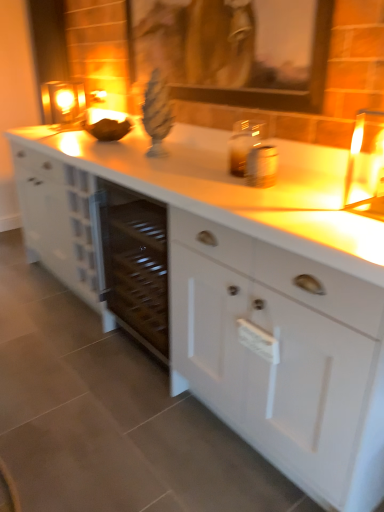
This screenshot has height=512, width=384. What are the coordinates of `wooden picture frame at upper center` in the screenshot? It's located at (235, 51).

At what (x,y) coordinates should I click in order to perform the action: click on matte glass candle at upper left. Please return your answer as a coordinate pair (x, y). Looking at the image, I should click on (63, 102).

You are a GUI agent. You are given a task and a screenshot of the screen. Output one action in this format:
    pyautogui.click(x=<x>, y=<y>)
    Task: Click on the wooden picture frame at upper center
    The image size is (384, 512).
    Given the screenshot: What is the action you would take?
    pyautogui.click(x=235, y=51)

Considering the relative positions of matte glass candle at upper left and white matte cabinet at center in the image provided, is matte glass candle at upper left in front of white matte cabinet at center?

No, matte glass candle at upper left is further to the viewer.

Is point (62, 89) behind point (190, 360)?

Yes, it is behind point (190, 360).

In the scene shown: Which of these two, matte glass candle at upper left or white matte cabinet at center, is bigger?

With larger size is white matte cabinet at center.

How different are the orientations of matte glass candle at upper left and white matte cabinet at center in degrees?

The angular difference between matte glass candle at upper left and white matte cabinet at center is 0.000517 degrees.

From a real-world perspective, does white matte cabinet at center sit lower than wooden picture frame at upper center?

Yes.

Considering the sizes of objects white matte cabinet at center and wooden picture frame at upper center in the image provided, who is bigger, white matte cabinet at center or wooden picture frame at upper center?

With larger size is white matte cabinet at center.

Is white matte cabinet at center further to camera compared to wooden picture frame at upper center?

No, white matte cabinet at center is closer to the viewer.

From a real-world perspective, is wooden picture frame at upper center positioned above or below white matte cabinet at center?

In terms of real-world spatial position, wooden picture frame at upper center is above white matte cabinet at center.

Is wooden picture frame at upper center at the right side of white matte cabinet at center?

No, wooden picture frame at upper center is not to the right of white matte cabinet at center.

Does wooden picture frame at upper center have a greater height compared to white matte cabinet at center?

Incorrect, the height of wooden picture frame at upper center is not larger of that of white matte cabinet at center.

In the image, is wooden picture frame at upper center positioned in front of or behind white matte cabinet at center?

wooden picture frame at upper center is positioned farther from the viewer than white matte cabinet at center.

Does white matte cabinet at center appear on the right side of matte glass candle at upper left?

Correct, you'll find white matte cabinet at center to the right of matte glass candle at upper left.

Is point (348, 388) positioned behind point (65, 112)?

That is False.

Which is in front, white matte cabinet at center or matte glass candle at upper left?

white matte cabinet at center is more forward.

Where is `candle holder that is below the wooden picture frame at upper center (from the image's perspective)`? candle holder that is below the wooden picture frame at upper center (from the image's perspective) is located at coordinates (63, 102).

From a real-world perspective, is wooden picture frame at upper center physically above matte glass candle at upper left?

Yes.

Could you tell me if wooden picture frame at upper center is turned towards matte glass candle at upper left?

No, wooden picture frame at upper center is not aimed at matte glass candle at upper left.

Between matte glass candle at upper left and wooden picture frame at upper center, which one has less height?

matte glass candle at upper left.

Which point is more distant from viewer, [57,105] or [317,80]?

Positioned behind is point [57,105].

Can you confirm if matte glass candle at upper left is positioned to the left of wooden picture frame at upper center?

Yes, matte glass candle at upper left is to the left of wooden picture frame at upper center.

The width and height of the screenshot is (384, 512). I want to click on candle holder above the white matte cabinet at center (from a real-world perspective), so click(x=63, y=102).

Identify the location of picture frame behind the white matte cabinet at center. (235, 51).

Which object lies further to the anchor point matte glass candle at upper left, white matte cabinet at center or wooden picture frame at upper center?

The object further to matte glass candle at upper left is white matte cabinet at center.

From the image, which object appears to be farther from wooden picture frame at upper center, white matte cabinet at center or matte glass candle at upper left?

matte glass candle at upper left is positioned further to the anchor wooden picture frame at upper center.

Considering their positions, is matte glass candle at upper left positioned closer to white matte cabinet at center than wooden picture frame at upper center?

The object closer to white matte cabinet at center is wooden picture frame at upper center.

From the image, which object appears to be farther from matte glass candle at upper left, wooden picture frame at upper center or white matte cabinet at center?

white matte cabinet at center is further to matte glass candle at upper left.

From the image, which object appears to be nearer to wooden picture frame at upper center, matte glass candle at upper left or white matte cabinet at center?

Based on the image, white matte cabinet at center appears to be nearer to wooden picture frame at upper center.

Looking at the image, which one is located closer to white matte cabinet at center, wooden picture frame at upper center or matte glass candle at upper left?

wooden picture frame at upper center.

Where is `picture frame located between white matte cabinet at center and matte glass candle at upper left in the depth direction`? picture frame located between white matte cabinet at center and matte glass candle at upper left in the depth direction is located at coordinates (235, 51).